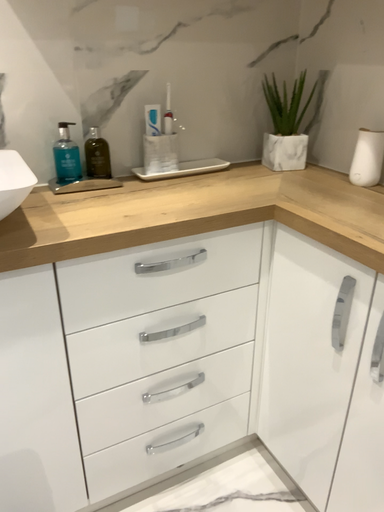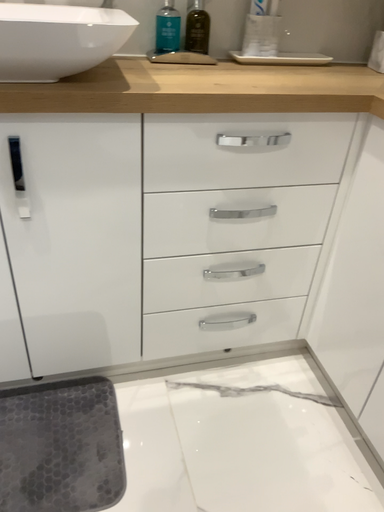
Question: How did the camera likely rotate when shooting the video?

Choices:
 (A) rotated right
 (B) rotated left

Answer: (B)